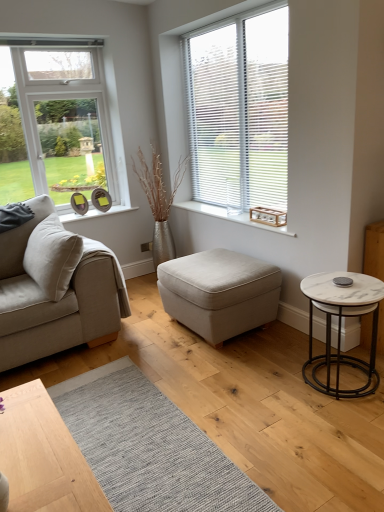
You are a GUI agent. You are given a task and a screenshot of the screen. Output one action in this format:
    pyautogui.click(x=<x>, y=<y>)
    Task: Click on the free point to the left of white marble side table at right
    The image size is (384, 512).
    Given the screenshot: What is the action you would take?
    pyautogui.click(x=262, y=386)